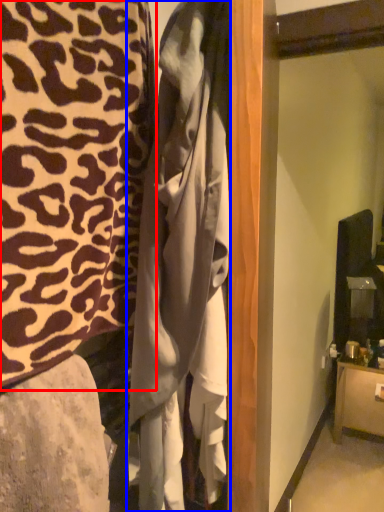
Question: Which of the following is the farthest to the observer, furniture (highlighted by a red box) or clothing (highlighted by a blue box)?

Choices:
 (A) furniture
 (B) clothing

Answer: (B)